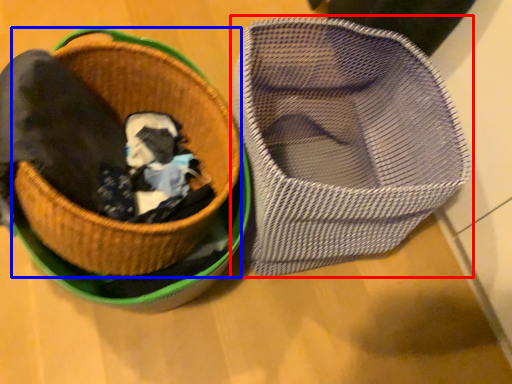
Question: Among these objects, which one is farthest to the camera, footwear (highlighted by a red box) or basket (highlighted by a blue box)?

Choices:
 (A) footwear
 (B) basket

Answer: (A)